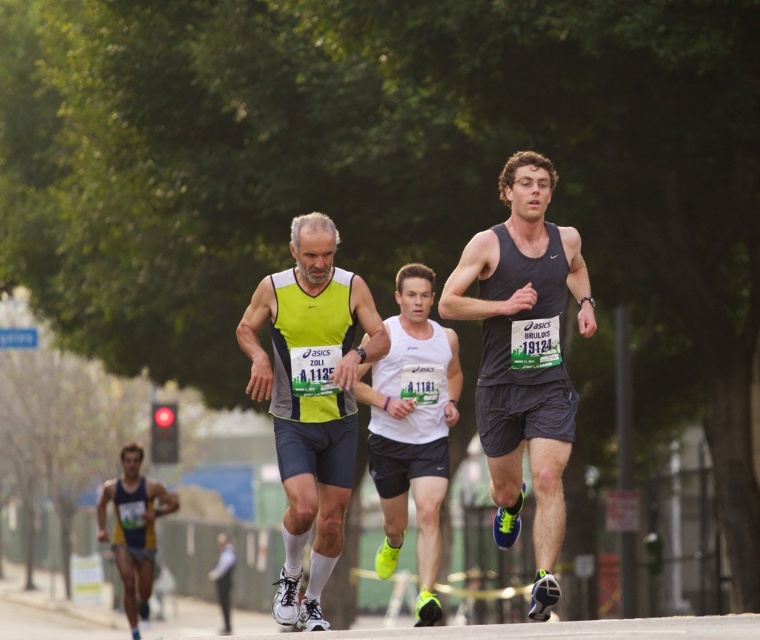
You are a photographer at the marathon race. You want to capture a photo of both the neon yellow fabric tank top at center and the white matte tank top at center. Which runner should you focus on first to ensure both are in the frame?

You should focus on the neon yellow fabric tank top at center first because it is bigger than the white matte tank top at center, ensuring it stays within the frame while adjusting for the smaller one.

You are a drone operator assigned to capture aerial footage of the marathon. Your task is to ensure that the drone stays above the blue and yellow athletic wear at lower left while maintaining a safe distance from the dark gray tank top at center. Can the drone maintain a vertical distance of at least 10 meters between these two runners?

The dark gray tank top at center is 9.68 meters from the blue and yellow athletic wear at lower left. Since the required vertical distance is 10 meters, the drone cannot maintain the required distance as the current separation is less than 10 meters.

You are a photographer at the marathon and want to capture both the dark gray tank top at center and the blue and yellow athletic wear at lower left in a single shot. Which runner should you focus on first to ensure both are in frame?

The dark gray tank top at center is smaller than the blue and yellow athletic wear at lower left, so focusing on the blue and yellow athletic wear at lower left first would allow the photographer to include both runners in the frame since it is larger and might be positioned lower left, making it easier to frame both.